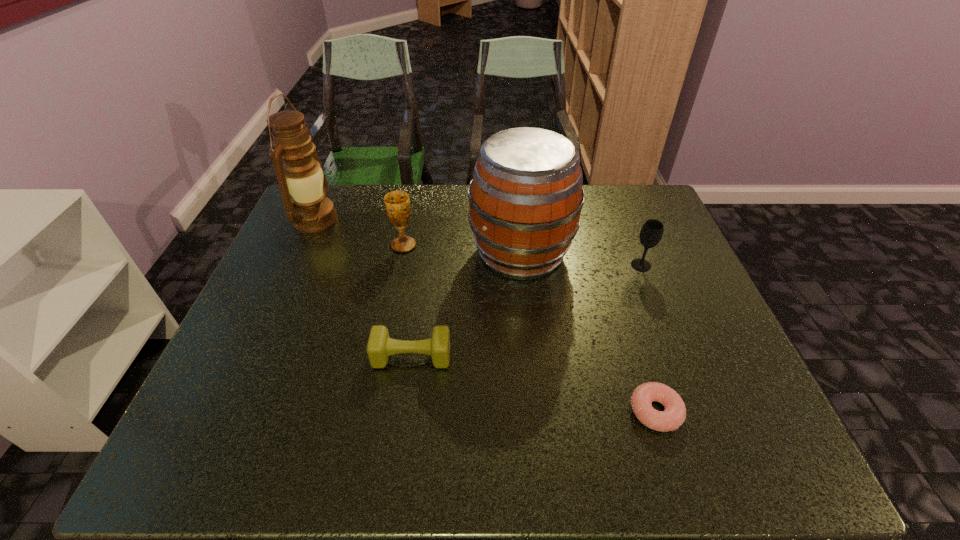
The image size is (960, 540). Find the location of `the nearest object`. the nearest object is located at coordinates click(674, 415).

Where is `vacant area situated 0.120m on the front of the leftmost object`? The width and height of the screenshot is (960, 540). vacant area situated 0.120m on the front of the leftmost object is located at coordinates pos(295,266).

Locate an element on the screen. The height and width of the screenshot is (540, 960). vacant region located on the front of the cider is located at coordinates (539, 430).

Image resolution: width=960 pixels, height=540 pixels. Identify the location of blank space located on the left of the chalice. (358, 245).

The height and width of the screenshot is (540, 960). What are the coordinates of `vacant space located on the front of the rightmost object` in the screenshot? It's located at (653, 295).

The width and height of the screenshot is (960, 540). I want to click on vacant space located 0.170m on the back of the second shortest object, so click(x=420, y=293).

The image size is (960, 540). I want to click on vacant area located 0.080m on the right of the shortest object, so click(720, 411).

I want to click on oil lamp located in the far edge section of the desktop, so click(309, 210).

The width and height of the screenshot is (960, 540). Find the location of `cider present at the far edge`. cider present at the far edge is located at coordinates (525, 200).

Locate an element on the screen. The height and width of the screenshot is (540, 960). object situated at the near edge is located at coordinates pyautogui.click(x=674, y=415).